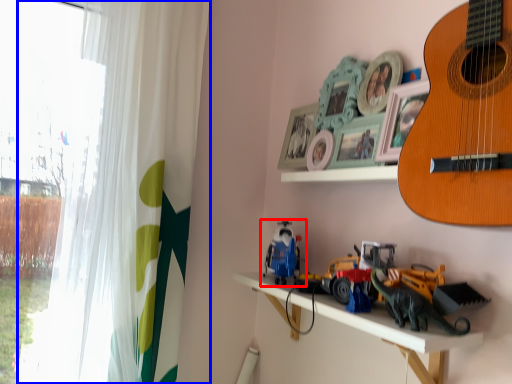
Question: Which object appears closest to the camera in this image, toy (highlighted by a red box) or curtain (highlighted by a blue box)?

Choices:
 (A) toy
 (B) curtain

Answer: (A)